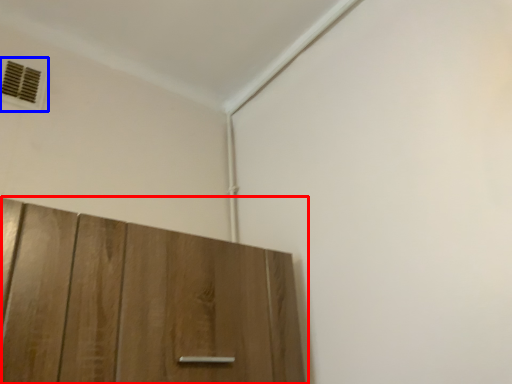
Question: Which object appears closest to the camera in this image, cupboard (highlighted by a red box) or air conditioning (highlighted by a blue box)?

Choices:
 (A) cupboard
 (B) air conditioning

Answer: (A)